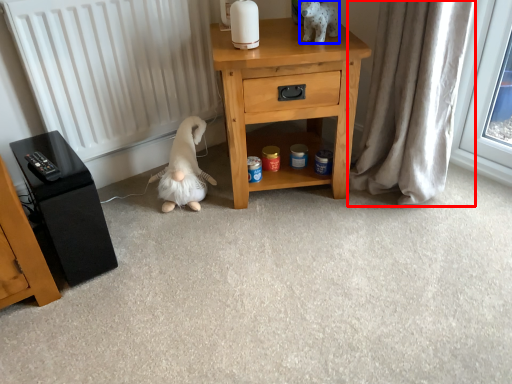
Question: Which object is closer to the camera taking this photo, curtain (highlighted by a red box) or animal (highlighted by a blue box)?

Choices:
 (A) curtain
 (B) animal

Answer: (A)